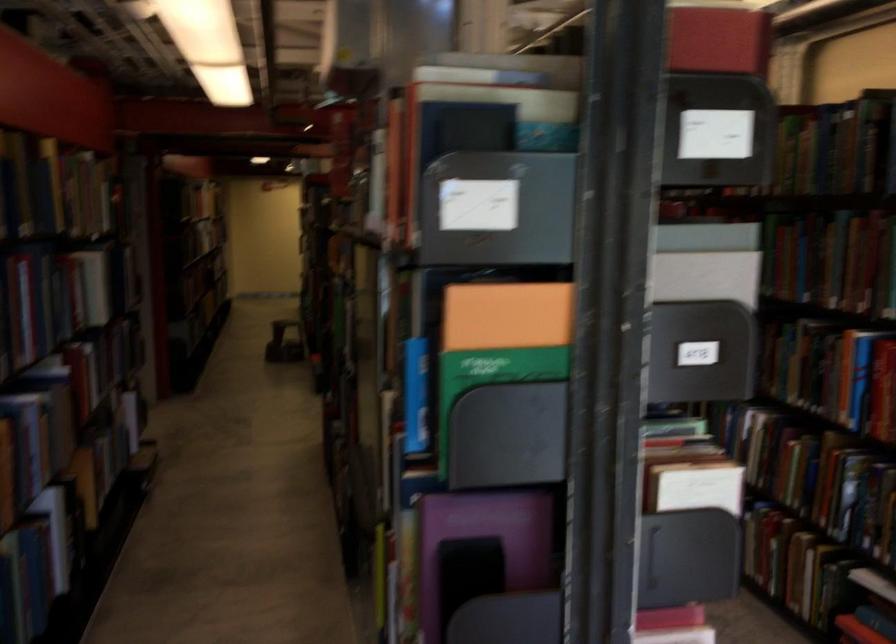
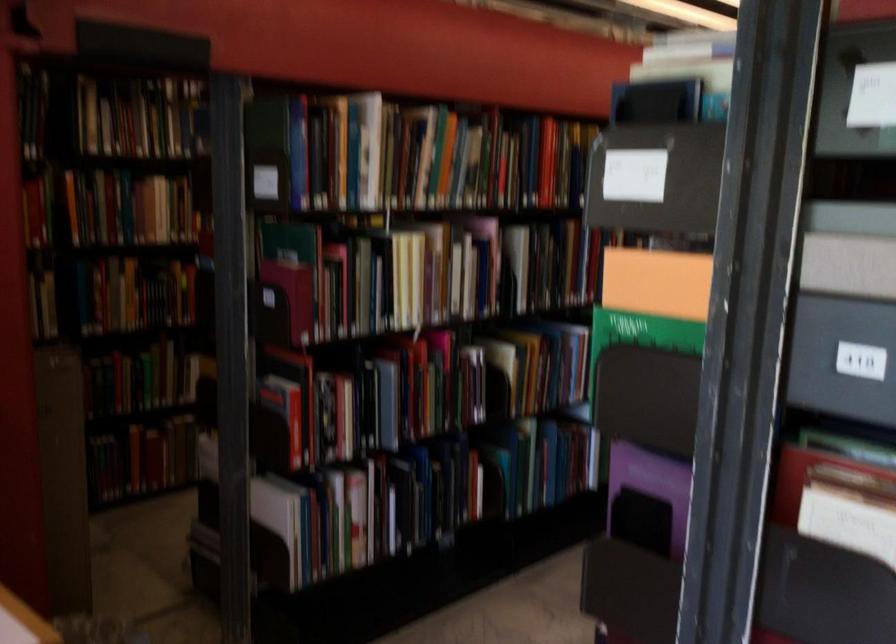
Find the pixel in the second image that matches the point at 496,322 in the first image.

(657, 283)